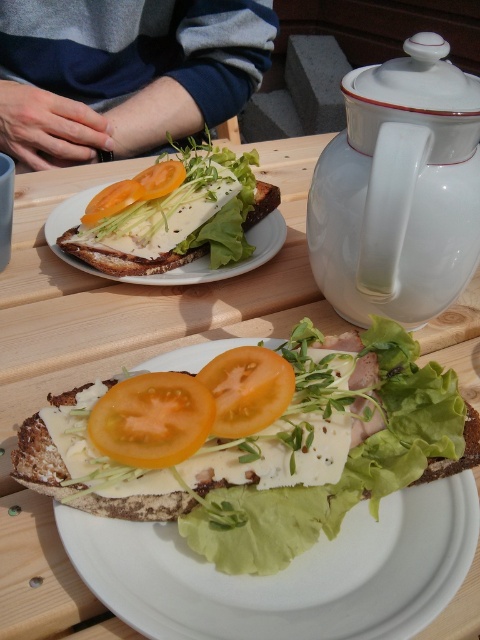
You are standing at a distance of 15 inches from the wooden table in the scene. If you want to reach the point at coordinates point (463,150), will you be able to touch it without moving closer?

The point (463,150) is 15.55 inches from the viewer. Since you are standing 15 inches away, you are slightly closer than the point, so you can extend your hand to touch it without needing to move closer.

You are a food critic analyzing the placement of ingredients on the plate. Where is the yellow juicy tomato at center positioned relative to the other items on the plate?

The yellow juicy tomato at center is located at point [247,388], which places it centrally on the plate.

You are a customer at this outdoor table. You want to pour tea from the white ceramic teapot at upper right into a cup located at the center of the table. Is the teapot positioned in a way that allows you to easily pour into the cup without moving the teapot? Please explain your reasoning based on the teapot and cup positions.

The white ceramic teapot at upper right is located at coordinates (398, 189). Since the cup is at the center of the table, the teapot is positioned to the upper right of the cup. This placement allows for a natural pouring motion without needing to move the teapot significantly, as it is already in a position that can easily reach the cup.